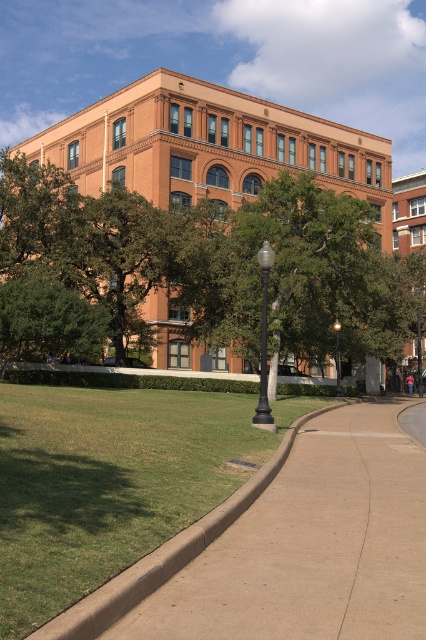
Is point (11, 326) more distant than point (267, 244)?

Yes, it is behind point (267, 244).

Can you confirm if green leafy tree at lower left is thinner than black polished metal lamp post at center?

Indeed, green leafy tree at lower left has a lesser width compared to black polished metal lamp post at center.

Between point (97, 305) and point (256, 410), which one is positioned in front?

Point (256, 410)

I want to click on green leafy tree at lower left, so click(x=48, y=320).

Is green leafy tree at upper left positioned behind green leafy tree at lower left?

Yes, green leafy tree at upper left is further from the viewer.

Does green leafy tree at upper left appear over green leafy tree at lower left?

Indeed, green leafy tree at upper left is positioned over green leafy tree at lower left.

This screenshot has height=640, width=426. Describe the element at coordinates (215, 259) in the screenshot. I see `green leafy tree at upper left` at that location.

What are the coordinates of `green leafy tree at upper left` in the screenshot? It's located at (215, 259).

Which is above, brown concrete curb at lower left or black glass lamp post at center?

black glass lamp post at center is above.

Between brown concrete curb at lower left and black glass lamp post at center, which one has more height?

With more height is brown concrete curb at lower left.

Is point (89, 616) more distant than point (337, 360)?

No, it is in front of (337, 360).

Locate an element on the screen. This screenshot has width=426, height=640. brown concrete curb at lower left is located at coordinates (166, 554).